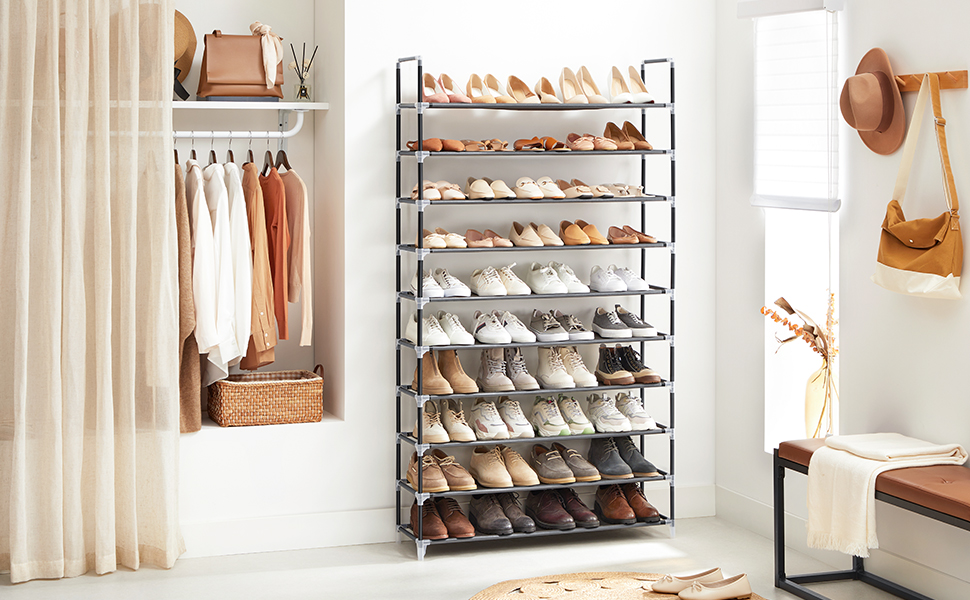
The image size is (970, 600). I want to click on the 3rd shelf of shoe rack, so click(435, 193), click(453, 192), click(479, 187), click(503, 187), click(528, 187), click(551, 187), click(577, 185), click(596, 190), click(623, 190), click(635, 188).